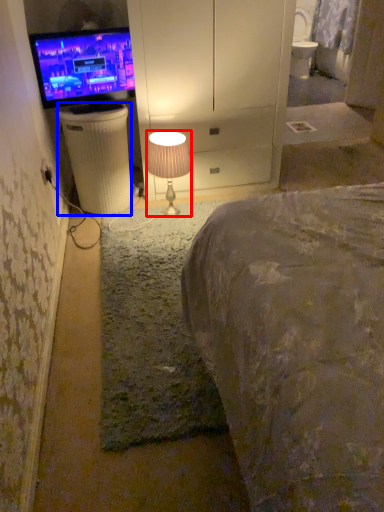
Question: Which of the following is the farthest to the observer, lamp (highlighted by a red box) or trash bin/can (highlighted by a blue box)?

Choices:
 (A) lamp
 (B) trash bin/can

Answer: (B)